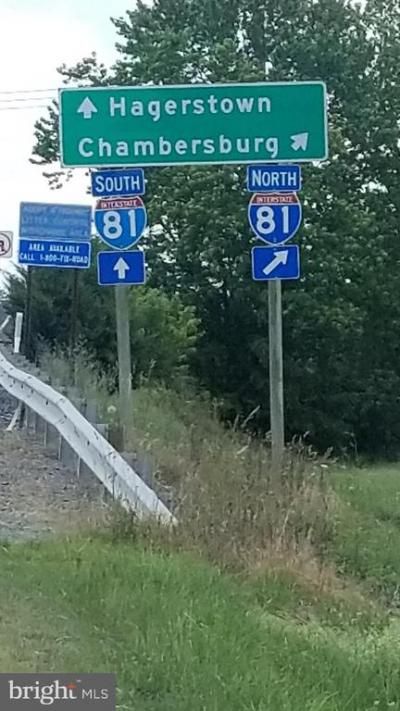
The height and width of the screenshot is (711, 400). Identify the location of metal side rail. (58, 414).